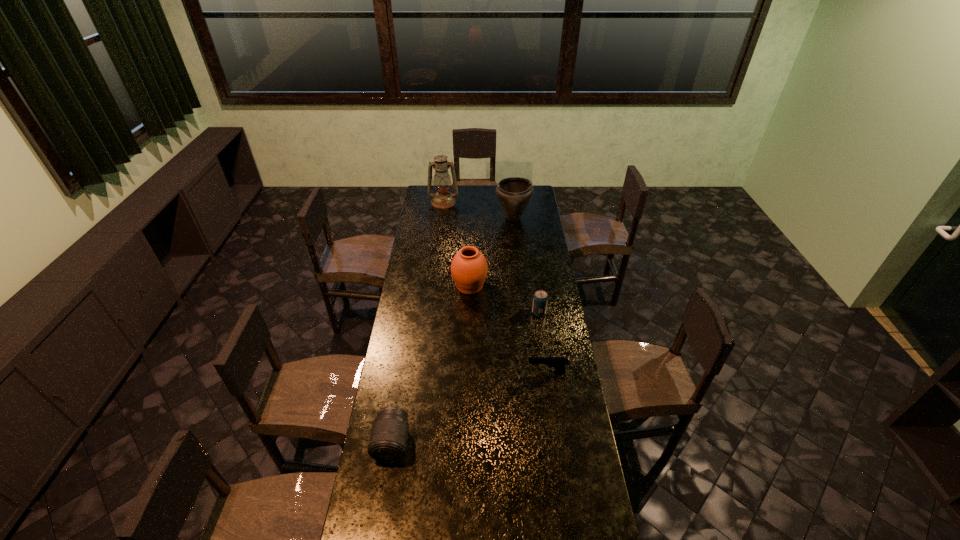
At what (x,y) coordinates should I click in order to perform the action: click on vacant space located on the back of the nearer urn. Please return your answer as a coordinate pair (x, y). Looking at the image, I should click on (470, 266).

I want to click on free spot located on the surface of the telephoto lens, so click(x=377, y=534).

Identify the location of vacant space located 0.270m on the back of the fourth farthest object. (533, 272).

The height and width of the screenshot is (540, 960). In order to click on vacant space located 0.210m on the front-facing side of the fifth farthest object in this screenshot , I will do `click(477, 372)`.

Locate an element on the screen. Image resolution: width=960 pixels, height=540 pixels. vacant point located 0.200m on the front-facing side of the fifth farthest object is located at coordinates click(x=479, y=372).

You are a GUI agent. You are given a task and a screenshot of the screen. Output one action in this format:
    pyautogui.click(x=<x>, y=<y>)
    Task: Click on the free space located 0.290m on the front-facing side of the fifth farthest object
    This screenshot has width=960, height=540.
    Given the screenshot: What is the action you would take?
    pyautogui.click(x=458, y=372)

Locate an element on the screen. The width and height of the screenshot is (960, 540). object at the far edge is located at coordinates (443, 199).

Find the location of a particular element. The width and height of the screenshot is (960, 540). oil lamp that is positioned at the left edge is located at coordinates (443, 199).

Find the location of a particular element. The height and width of the screenshot is (540, 960). telephoto lens situated at the left edge is located at coordinates (388, 441).

Identify the location of urn present at the right edge. This screenshot has width=960, height=540. (514, 193).